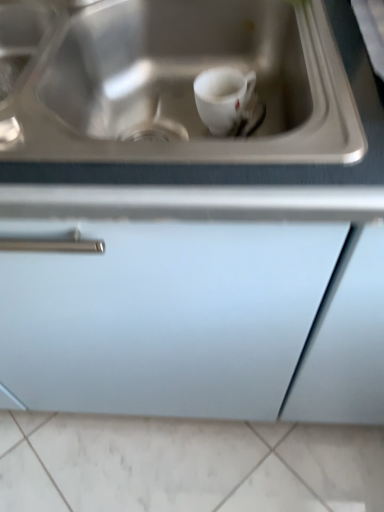
Question: Is stainless steel sink at upper center positioned beyond the bounds of white marble tile at lower center?

Choices:
 (A) no
 (B) yes

Answer: (B)

Question: Can you confirm if stainless steel sink at upper center is taller than white marble tile at lower center?

Choices:
 (A) no
 (B) yes

Answer: (B)

Question: Is white marble tile at lower center surrounded by stainless steel sink at upper center?

Choices:
 (A) no
 (B) yes

Answer: (A)

Question: Is stainless steel sink at upper center thinner than white marble tile at lower center?

Choices:
 (A) no
 (B) yes

Answer: (B)

Question: Would you consider stainless steel sink at upper center to be distant from white marble tile at lower center?

Choices:
 (A) no
 (B) yes

Answer: (A)

Question: Considering the positions of stainless steel sink at upper center and matte white cabinet at center in the image, is stainless steel sink at upper center taller or shorter than matte white cabinet at center?

Choices:
 (A) short
 (B) tall

Answer: (A)

Question: Is stainless steel sink at upper center spatially inside matte white cabinet at center, or outside of it?

Choices:
 (A) inside
 (B) outside

Answer: (A)

Question: Considering their positions, is stainless steel sink at upper center located in front of or behind matte white cabinet at center?

Choices:
 (A) behind
 (B) front

Answer: (A)

Question: From a real-world perspective, is stainless steel sink at upper center positioned above or below matte white cabinet at center?

Choices:
 (A) above
 (B) below

Answer: (A)

Question: From the image's perspective, is white marble tile at lower center located above or below matte white cabinet at center?

Choices:
 (A) above
 (B) below

Answer: (B)

Question: Considering the relative positions of white marble tile at lower center and matte white cabinet at center in the image provided, is white marble tile at lower center to the left or to the right of matte white cabinet at center?

Choices:
 (A) left
 (B) right

Answer: (B)

Question: Looking at their shapes, would you say white marble tile at lower center is wider or thinner than matte white cabinet at center?

Choices:
 (A) thin
 (B) wide

Answer: (B)

Question: From a real-world perspective, relative to matte white cabinet at center, is white marble tile at lower center vertically above or below?

Choices:
 (A) above
 (B) below

Answer: (B)

Question: Looking at their shapes, would you say white glossy mug at center is wider or thinner than stainless steel sink at upper center?

Choices:
 (A) wide
 (B) thin

Answer: (B)

Question: In terms of size, does white glossy mug at center appear bigger or smaller than stainless steel sink at upper center?

Choices:
 (A) big
 (B) small

Answer: (B)